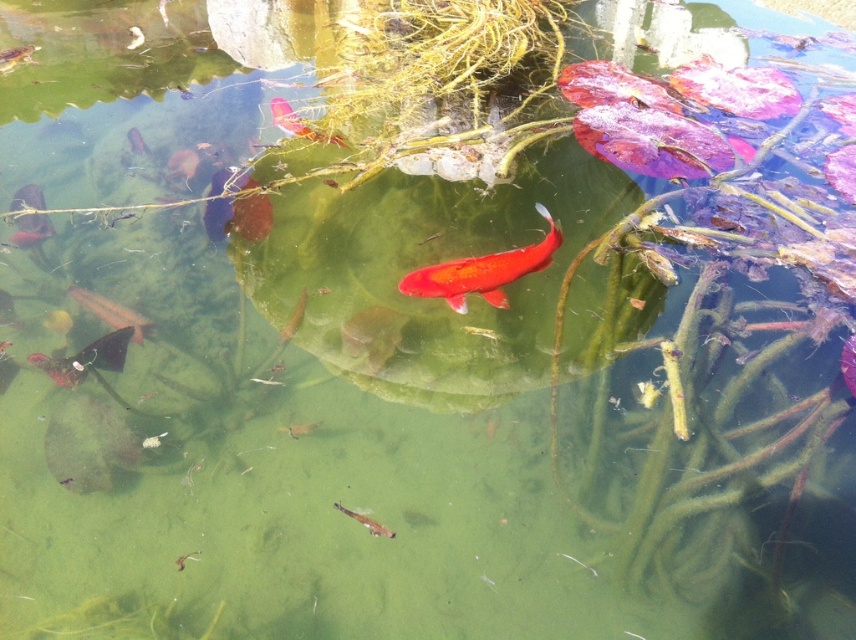
You are a photographer trying to capture the shiny metallic fish at bottom left and the shiny orange fish at upper center in a single frame. Based on their sizes, which fish should you focus on to ensure both are clearly visible in the photo?

The shiny metallic fish at bottom left is not as tall as the shiny orange fish at upper center, so you should focus on the shiny orange fish at upper center to ensure both are clearly visible in the photo.

You are a photographer aiming to capture both the shiny metallic fish at bottom left and the shiny orange fish at upper center in one frame. Based on their positions, which fish should you focus on first to ensure both are in the shot?

The shiny metallic fish at bottom left is located below the shiny orange fish at upper center, so you should focus on the shiny orange fish at upper center first to ensure both are in the frame.

You are a photographer standing at the edge of the pond. You want to take a closeup photo of the shiny orange fish at center. If your camera has a maximum focus range of 8 feet, will you be able to focus on the fish?

The shiny orange fish at center is 8.86 feet away from camera. Since the camera can only focus up to 8 feet, you will not be able to focus on the fish.